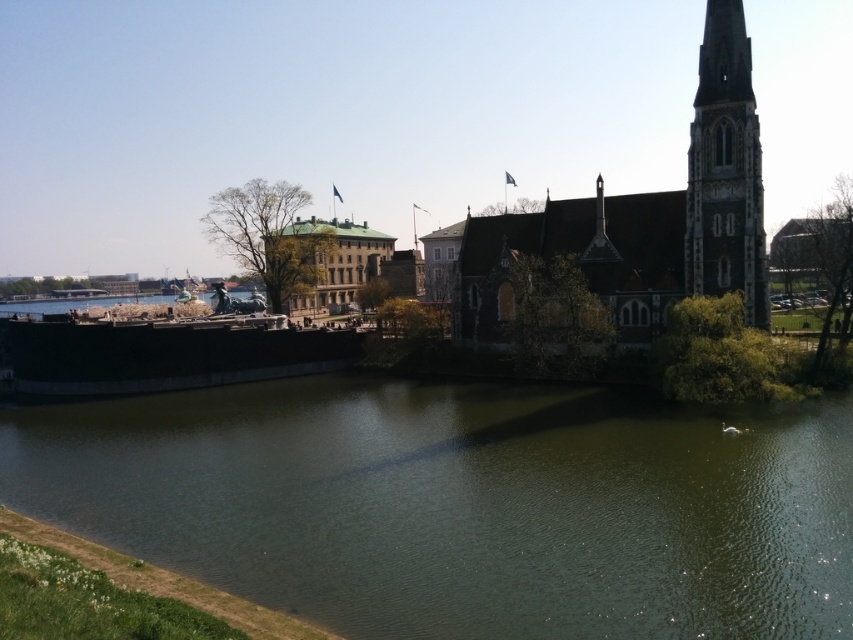
Between greenish water at center and stone gothic church at right, which one is positioned higher?

stone gothic church at right is higher up.

From the picture: Does greenish water at center appear on the left side of stone gothic church at right?

Correct, you'll find greenish water at center to the left of stone gothic church at right.

Describe the element at coordinates (463, 506) in the screenshot. I see `greenish water at center` at that location.

In order to click on greenish water at center in this screenshot , I will do `click(463, 506)`.

Is dark gray stone tower at upper right to the left of green shingled roof building at center from the viewer's perspective?

In fact, dark gray stone tower at upper right is to the right of green shingled roof building at center.

Does dark gray stone tower at upper right have a larger size compared to green shingled roof building at center?

Actually, dark gray stone tower at upper right might be smaller than green shingled roof building at center.

Between point (750, 76) and point (288, 300), which one is positioned in front?

Point (750, 76) is more forward.

Where is `dark gray stone tower at upper right`? This screenshot has height=640, width=853. dark gray stone tower at upper right is located at coordinates (724, 170).

Does stone gothic church at right appear on the right side of green shingled roof building at center?

Correct, you'll find stone gothic church at right to the right of green shingled roof building at center.

Does stone gothic church at right have a lesser width compared to green shingled roof building at center?

No, stone gothic church at right is not thinner than green shingled roof building at center.

Is point (590, 272) farther from camera compared to point (305, 276)?

No.

I want to click on stone gothic church at right, so pos(646,218).